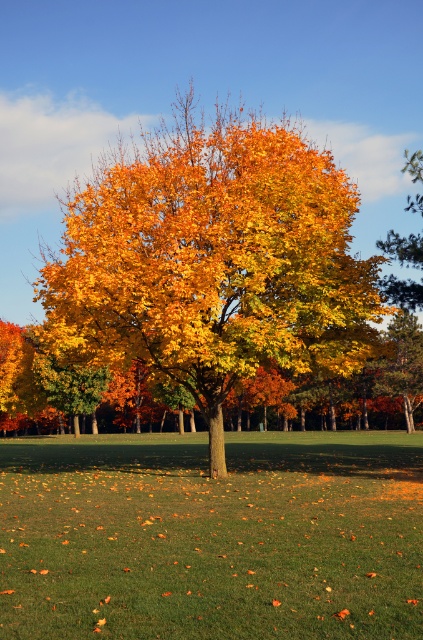
Question: Which of these objects is positioned farthest from the green grass at center?

Choices:
 (A) golden leafy tree at center
 (B) golden yellow leaves at upper right

Answer: (A)

Question: Is green grass at center positioned at the back of golden leafy tree at center?

Choices:
 (A) yes
 (B) no

Answer: (B)

Question: Which is nearer to the golden yellow leaves at upper right?

Choices:
 (A) golden leafy tree at center
 (B) green grass at center

Answer: (B)

Question: Can you confirm if golden leafy tree at center is wider than golden yellow leaves at upper right?

Choices:
 (A) no
 (B) yes

Answer: (B)

Question: Is golden leafy tree at center positioned behind golden yellow leaves at upper right?

Choices:
 (A) no
 (B) yes

Answer: (A)

Question: Based on their relative distances, which object is nearer to the golden leafy tree at center?

Choices:
 (A) green grass at center
 (B) golden yellow leaves at upper right

Answer: (B)